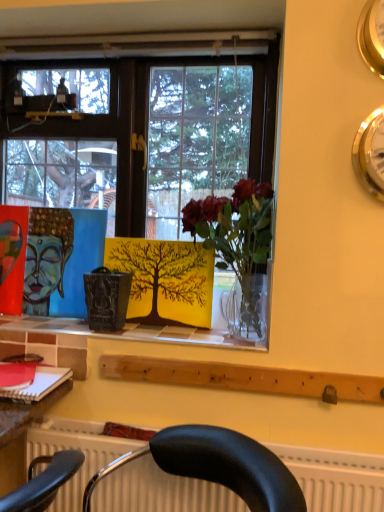
Identify the location of vacant space underneath translucent glass vase at center (from a real-world perspective). pyautogui.click(x=215, y=337).